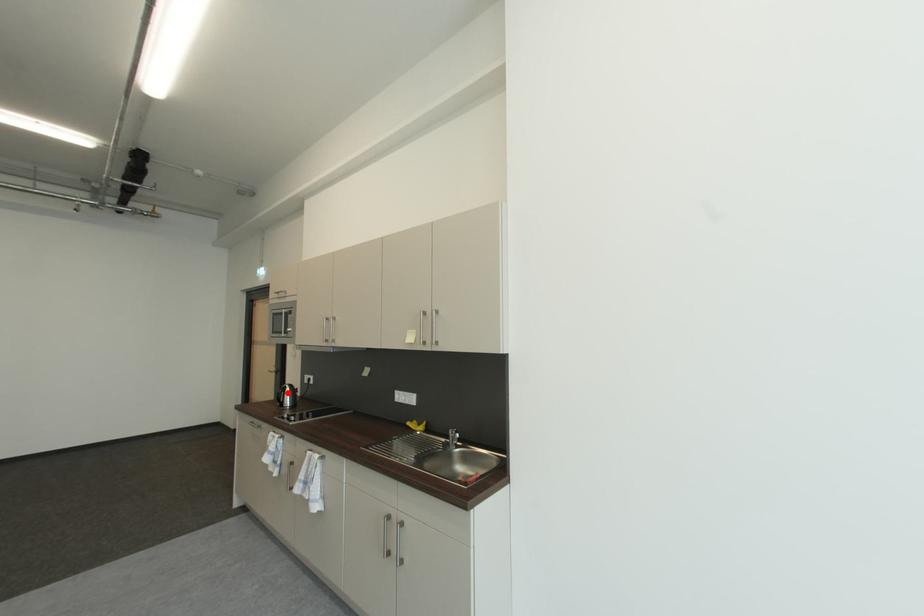
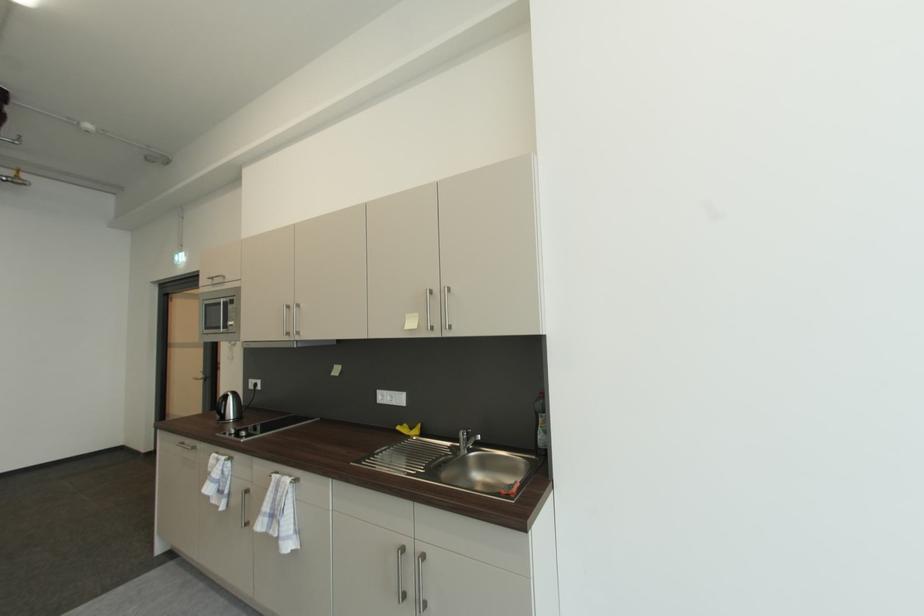
Find the pixel in the second image that matches the highlighted location in the first image.

(227, 402)